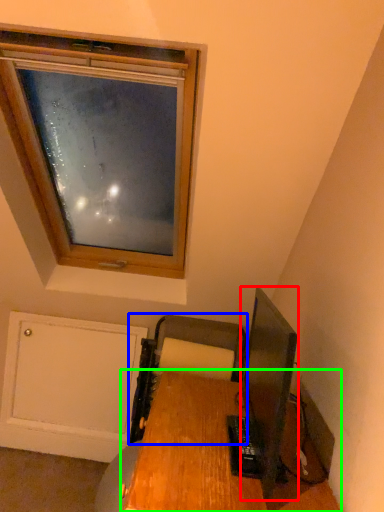
Question: Which object is positioned closest to television (highlighted by a red box)? Select from printer (highlighted by a blue box) and desk (highlighted by a green box).

Choices:
 (A) printer
 (B) desk

Answer: (A)